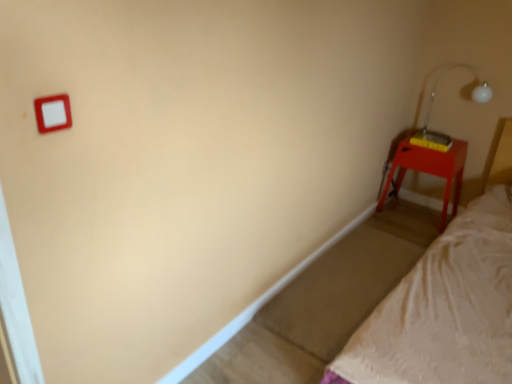
Find the location of `free point below transparent plastic lamp at upper right (from a real-world perspective)`. free point below transparent plastic lamp at upper right (from a real-world perspective) is located at coordinates (441, 137).